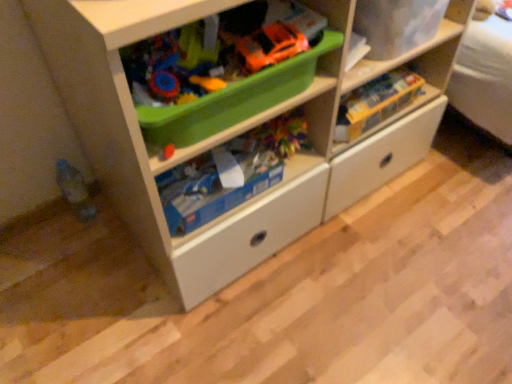
Where is `vacant space positioned to the left of orange matte toy car at upper center`? This screenshot has width=512, height=384. vacant space positioned to the left of orange matte toy car at upper center is located at coordinates pos(201,56).